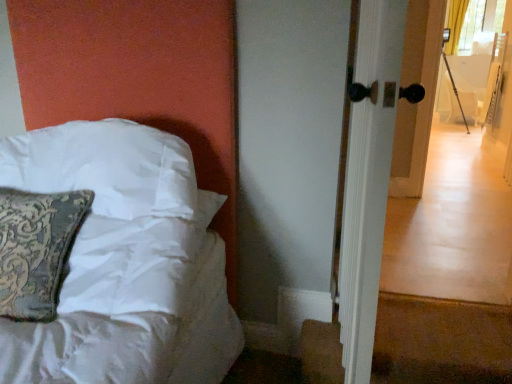
Question: Can you confirm if white glossy door handle at right is thinner than white satin pillow at left?

Choices:
 (A) yes
 (B) no

Answer: (A)

Question: From a real-world perspective, is white glossy door handle at right on white satin pillow at left?

Choices:
 (A) no
 (B) yes

Answer: (B)

Question: Does white glossy door handle at right have a larger size compared to white satin pillow at left?

Choices:
 (A) no
 (B) yes

Answer: (B)

Question: Considering the relative positions of white glossy door handle at right and white satin pillow at left in the image provided, is white glossy door handle at right in front of white satin pillow at left?

Choices:
 (A) no
 (B) yes

Answer: (B)

Question: Is white glossy door handle at right far from white satin pillow at left?

Choices:
 (A) yes
 (B) no

Answer: (B)

Question: Can you see white glossy door handle at right touching white satin pillow at left?

Choices:
 (A) yes
 (B) no

Answer: (B)

Question: Are white satin pillow at left and white fabric armchair at right far apart?

Choices:
 (A) no
 (B) yes

Answer: (B)

Question: Considering the relative positions of white satin pillow at left and white fabric armchair at right in the image provided, is white satin pillow at left behind white fabric armchair at right?

Choices:
 (A) no
 (B) yes

Answer: (A)

Question: Is white satin pillow at left not within white fabric armchair at right?

Choices:
 (A) no
 (B) yes

Answer: (B)

Question: Is white satin pillow at left turned away from white fabric armchair at right?

Choices:
 (A) no
 (B) yes

Answer: (B)

Question: Does white satin pillow at left touch white fabric armchair at right?

Choices:
 (A) yes
 (B) no

Answer: (B)

Question: Does white satin pillow at left turn towards white fabric armchair at right?

Choices:
 (A) yes
 (B) no

Answer: (B)

Question: Does white satin pillow at left have a greater height compared to white glossy door handle at right?

Choices:
 (A) no
 (B) yes

Answer: (A)